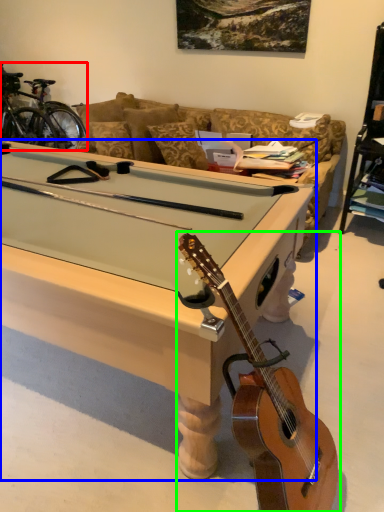
Question: Considering the real-world distances, which object is farthest from bicycle (highlighted by a red box)? desk (highlighted by a blue box) or guitar (highlighted by a green box)?

Choices:
 (A) desk
 (B) guitar

Answer: (B)